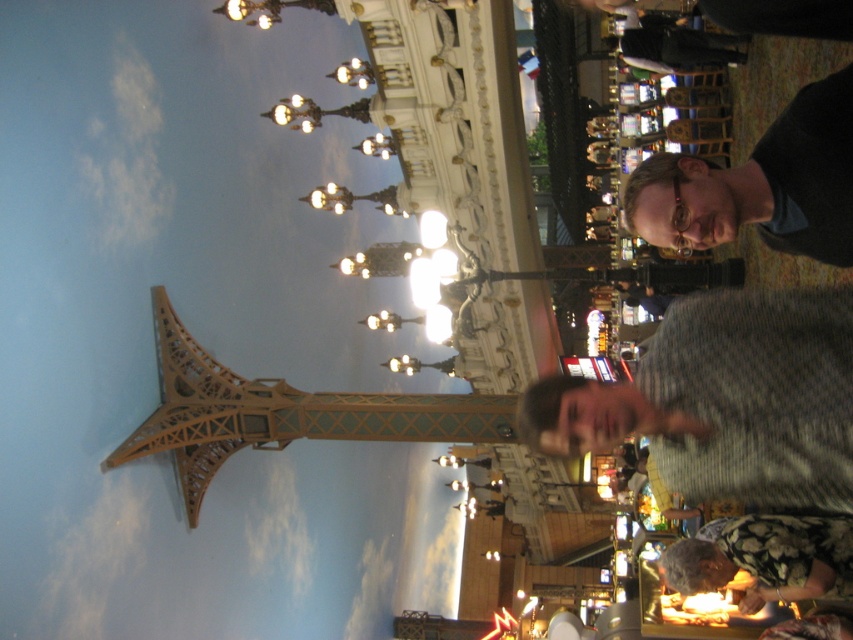
Does matte black shirt at upper right appear over floral-patterned fabric at lower right?

Correct, matte black shirt at upper right is located above floral-patterned fabric at lower right.

Does matte black shirt at upper right have a greater width compared to floral-patterned fabric at lower right?

Indeed, matte black shirt at upper right has a greater width compared to floral-patterned fabric at lower right.

Who is more distant from viewer, (837, 264) or (781, 532)?

The point (781, 532) is more distant.

Where is `matte black shirt at upper right`? This screenshot has width=853, height=640. matte black shirt at upper right is located at coordinates (764, 182).

Is gray knitted sweater at lower right positioned before floral-patterned fabric at lower right?

Yes, it is.

Who is more forward, (780,468) or (793,564)?

Point (780,468) is in front.

Does point (537, 396) come in front of point (834, 516)?

Yes.

Where is `gray knitted sweater at lower right`? The width and height of the screenshot is (853, 640). gray knitted sweater at lower right is located at coordinates (724, 400).

Which is above, gray knitted sweater at lower right or matte black shirt at upper right?

Positioned higher is matte black shirt at upper right.

Does gray knitted sweater at lower right come behind matte black shirt at upper right?

No, it is not.

You are a GUI agent. You are given a task and a screenshot of the screen. Output one action in this format:
    pyautogui.click(x=<x>, y=<y>)
    Task: Click on the gray knitted sweater at lower right
    Image resolution: width=853 pixels, height=640 pixels.
    Given the screenshot: What is the action you would take?
    pyautogui.click(x=724, y=400)